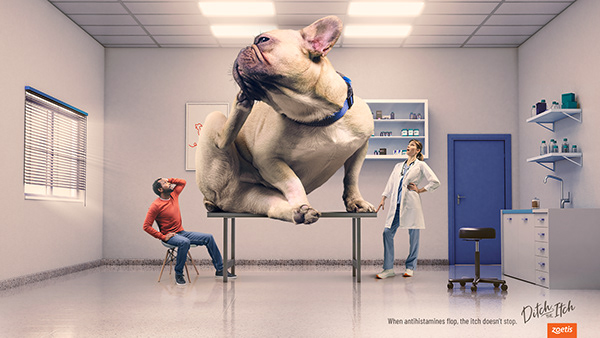
You are a GUI agent. You are given a task and a screenshot of the screen. Output one action in this format:
    pyautogui.click(x=<x>, y=<y>)
    Task: Click on the table
    
    Given the screenshot: What is the action you would take?
    pyautogui.click(x=331, y=210)